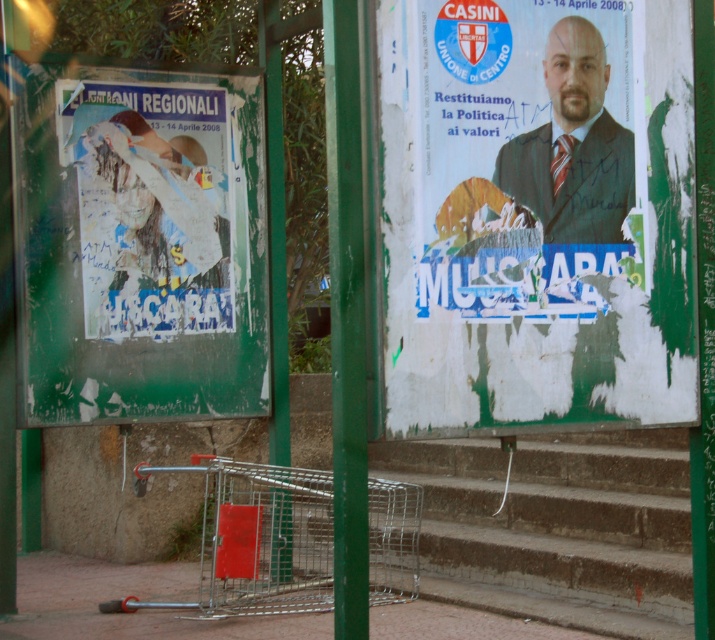
Question: Is scratched paper poster at left positioned before white paper poster at left?

Choices:
 (A) yes
 (B) no

Answer: (A)

Question: Can you confirm if scratched paper poster at left is thinner than white paper poster at left?

Choices:
 (A) yes
 (B) no

Answer: (B)

Question: Which point is farther to the camera?

Choices:
 (A) white paper poster at left
 (B) green painted metal pole at center
 (C) matte white poster at center
 (D) concrete stairs at lower center

Answer: (A)

Question: Based on their relative distances, which object is nearer to the green painted metal pole at center?

Choices:
 (A) concrete stairs at lower center
 (B) white paper poster at left

Answer: (B)

Question: Which object is positioned farthest from the matte white poster at center?

Choices:
 (A) concrete stairs at lower center
 (B) matte black suit at upper center

Answer: (A)

Question: Can you confirm if scratched paper poster at left is positioned above green painted metal pole at center?

Choices:
 (A) yes
 (B) no

Answer: (A)